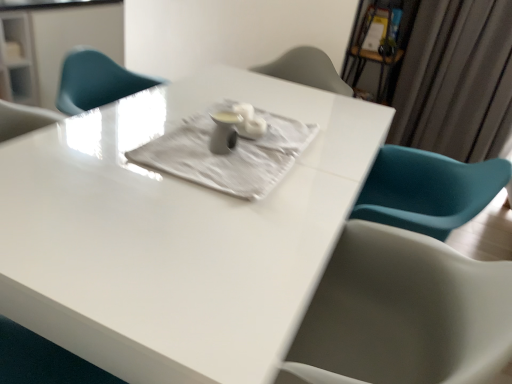
Question: Can you confirm if silky gray curtain at upper right is shorter than white glossy table at center?

Choices:
 (A) yes
 (B) no

Answer: (B)

Question: From a real-world perspective, is silky gray curtain at upper right physically below white glossy table at center?

Choices:
 (A) yes
 (B) no

Answer: (B)

Question: Is silky gray curtain at upper right positioned before white glossy table at center?

Choices:
 (A) no
 (B) yes

Answer: (A)

Question: Does silky gray curtain at upper right have a larger size compared to white glossy table at center?

Choices:
 (A) no
 (B) yes

Answer: (A)

Question: Considering the relative sizes of silky gray curtain at upper right and white glossy table at center in the image provided, is silky gray curtain at upper right taller than white glossy table at center?

Choices:
 (A) no
 (B) yes

Answer: (B)

Question: Do you think silky gray curtain at upper right is within white textured cloth at center, or outside of it?

Choices:
 (A) outside
 (B) inside

Answer: (A)

Question: Looking at the image, does silky gray curtain at upper right seem bigger or smaller compared to white textured cloth at center?

Choices:
 (A) small
 (B) big

Answer: (B)

Question: In the image, is silky gray curtain at upper right positioned in front of or behind white textured cloth at center?

Choices:
 (A) behind
 (B) front

Answer: (A)

Question: Is silky gray curtain at upper right wider or thinner than white textured cloth at center?

Choices:
 (A) thin
 (B) wide

Answer: (A)

Question: Is white glossy table at center in front of or behind silky gray curtain at upper right in the image?

Choices:
 (A) front
 (B) behind

Answer: (A)

Question: From a real-world perspective, is white glossy table at center above or below silky gray curtain at upper right?

Choices:
 (A) below
 (B) above

Answer: (A)

Question: Looking at their shapes, would you say white glossy table at center is wider or thinner than silky gray curtain at upper right?

Choices:
 (A) wide
 (B) thin

Answer: (A)

Question: In the image, is white glossy table at center on the left side or the right side of silky gray curtain at upper right?

Choices:
 (A) right
 (B) left

Answer: (B)

Question: From the image's perspective, relative to white glossy table at center, is white textured cloth at center above or below?

Choices:
 (A) below
 (B) above

Answer: (B)

Question: Is white textured cloth at center inside or outside of white glossy table at center?

Choices:
 (A) outside
 (B) inside

Answer: (B)